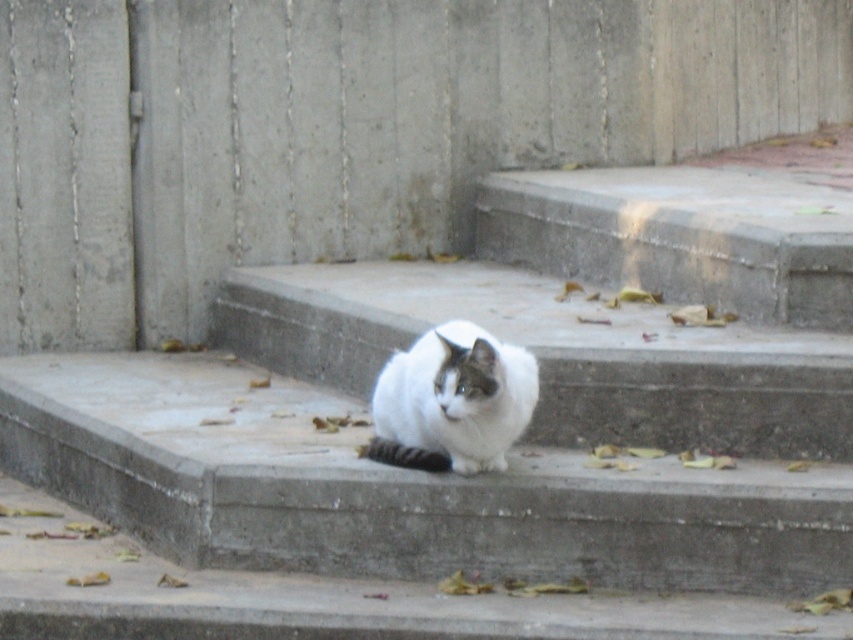
Which is more to the right, concrete stairs at center or white fluffy cat at center?

Positioned to the right is white fluffy cat at center.

Does point (596, 349) lie in front of point (491, 356)?

No, (596, 349) is behind (491, 356).

Where is `concrete stairs at center`? This screenshot has width=853, height=640. concrete stairs at center is located at coordinates (476, 476).

Where is `concrete stairs at center`? The height and width of the screenshot is (640, 853). concrete stairs at center is located at coordinates (476, 476).